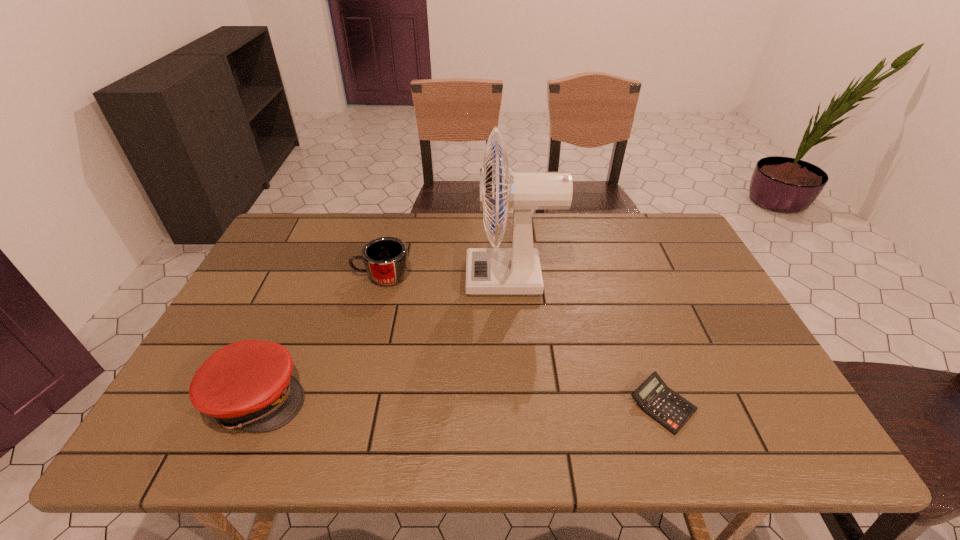
Locate an element on the screen. This screenshot has height=540, width=960. fan is located at coordinates (489, 271).

Where is `the tallest object`? The image size is (960, 540). the tallest object is located at coordinates (489, 271).

You are a GUI agent. You are given a task and a screenshot of the screen. Output one action in this format:
    pyautogui.click(x=<x>, y=<y>)
    Task: Click on the third object from right to left
    
    Given the screenshot: What is the action you would take?
    pyautogui.click(x=386, y=258)

At what (x,y) coordinates should I click in order to perform the action: click on cap. Please return your answer as a coordinate pair (x, y). Looking at the image, I should click on (247, 385).

Identify the location of calculator. (656, 399).

Identify the location of the rightmost object. The height and width of the screenshot is (540, 960). (656, 399).

This screenshot has width=960, height=540. In order to click on vacant area situated 0.090m on the front-facing side of the fan in this screenshot , I will do `click(437, 278)`.

Where is `free region located 0.210m on the front-facing side of the fan`? The image size is (960, 540). free region located 0.210m on the front-facing side of the fan is located at coordinates (396, 278).

The width and height of the screenshot is (960, 540). I want to click on vacant area situated 0.200m on the front-facing side of the fan, so click(x=399, y=278).

Where is `vacant space located 0.230m on the side of the second object from left to right with the handle`? This screenshot has height=540, width=960. vacant space located 0.230m on the side of the second object from left to right with the handle is located at coordinates (276, 276).